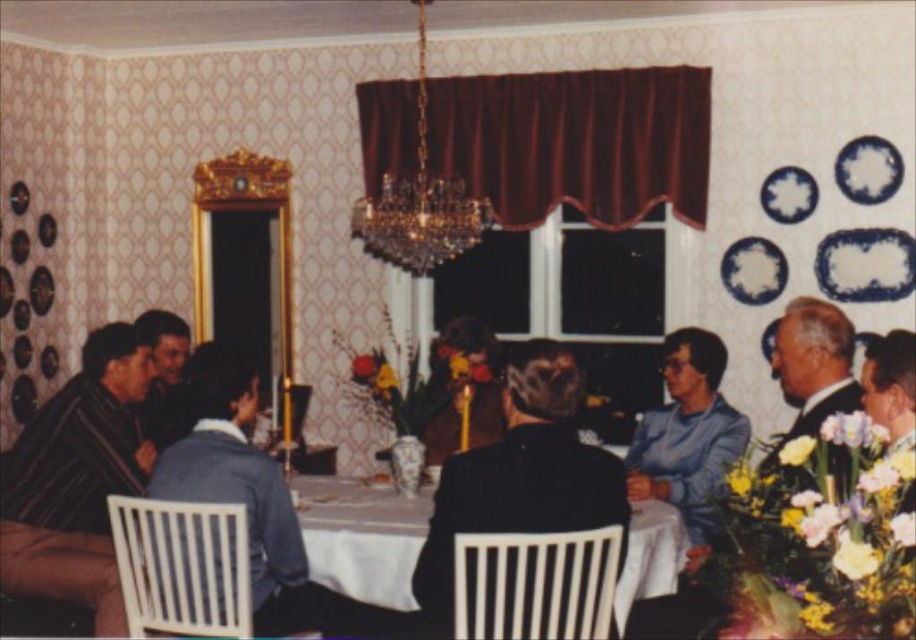
Does dark gray suit at right appear over dark brown hair at center?

Actually, dark gray suit at right is below dark brown hair at center.

Can you confirm if dark gray suit at right is wider than dark brown hair at center?

Indeed, dark gray suit at right has a greater width compared to dark brown hair at center.

Is point (820, 346) farther from viewer compared to point (162, 440)?

No, it is not.

The height and width of the screenshot is (640, 916). Identify the location of dark gray suit at right. (812, 368).

Measure the distance from crystal glass chandelier at upper center to dark brown hair at center.

A distance of 3.71 feet exists between crystal glass chandelier at upper center and dark brown hair at center.

At what (x,y) coordinates should I click in order to perform the action: click on crystal glass chandelier at upper center. Please return your answer as a coordinate pair (x, y). Looking at the image, I should click on (420, 200).

This screenshot has height=640, width=916. Find the location of `crystal glass chandelier at upper center`. crystal glass chandelier at upper center is located at coordinates (420, 200).

How distant is striped fabric shirt at left from dark brown hair at center?

A distance of 16.98 inches exists between striped fabric shirt at left and dark brown hair at center.

Measure the distance between point (147, 456) and camera.

They are 3.71 meters apart.

This screenshot has width=916, height=640. Find the location of `striped fabric shirt at left`. striped fabric shirt at left is located at coordinates (78, 480).